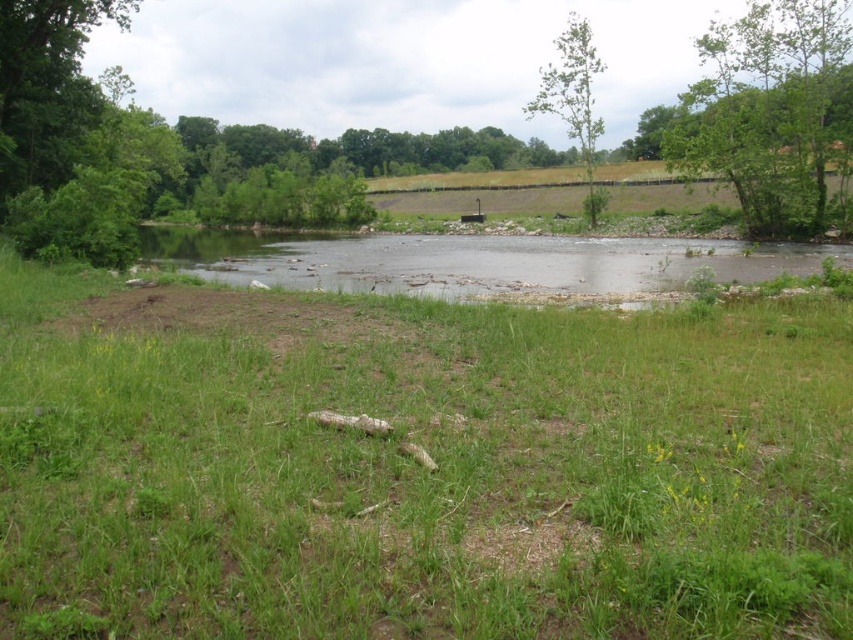
Question: Which point is closer to the camera taking this photo?

Choices:
 (A) (276, 284)
 (B) (511, 592)

Answer: (B)

Question: Among these objects, which one is farthest from the camera?

Choices:
 (A) green leafy tree at upper right
 (B) green leafy tree at upper center
 (C) green grassy at center
 (D) clear water at center

Answer: (B)

Question: In this image, where is green grassy at center located relative to green leafy tree at upper center?

Choices:
 (A) right
 (B) left

Answer: (B)

Question: Where is green grassy at center located in relation to green leafy tree at upper center in the image?

Choices:
 (A) above
 (B) below

Answer: (B)

Question: Is the position of clear water at center less distant than that of green leafy tree at upper center?

Choices:
 (A) no
 (B) yes

Answer: (B)

Question: Which object is closer to the camera taking this photo?

Choices:
 (A) clear water at center
 (B) green grassy at center

Answer: (B)